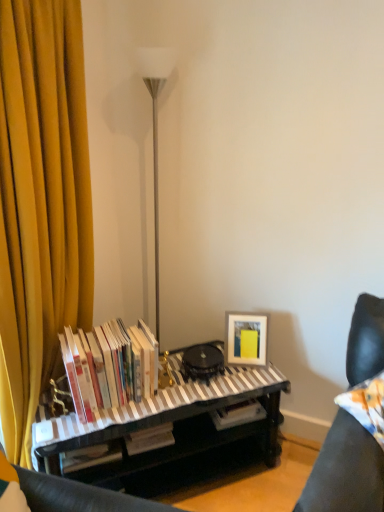
Question: Can you confirm if striped fabric piano at center is shorter than leather couch cushion at lower right?

Choices:
 (A) yes
 (B) no

Answer: (A)

Question: Is striped fabric piano at center at the right side of leather couch cushion at lower right?

Choices:
 (A) yes
 (B) no

Answer: (B)

Question: Could you tell me if striped fabric piano at center is facing leather couch cushion at lower right?

Choices:
 (A) yes
 (B) no

Answer: (B)

Question: From the image's perspective, is striped fabric piano at center beneath leather couch cushion at lower right?

Choices:
 (A) yes
 (B) no

Answer: (A)

Question: Is the surface of striped fabric piano at center in direct contact with leather couch cushion at lower right?

Choices:
 (A) no
 (B) yes

Answer: (A)

Question: Would you say leather couch cushion at lower right is inside or outside striped fabric piano at center?

Choices:
 (A) inside
 (B) outside

Answer: (B)

Question: Considering their positions, is leather couch cushion at lower right located in front of or behind striped fabric piano at center?

Choices:
 (A) behind
 (B) front

Answer: (B)

Question: In terms of height, does leather couch cushion at lower right look taller or shorter compared to striped fabric piano at center?

Choices:
 (A) short
 (B) tall

Answer: (B)

Question: Considering the positions of leather couch cushion at lower right and striped fabric piano at center in the image, is leather couch cushion at lower right wider or thinner than striped fabric piano at center?

Choices:
 (A) wide
 (B) thin

Answer: (B)

Question: Does point (236, 316) appear closer or farther from the camera than point (162, 454)?

Choices:
 (A) closer
 (B) farther

Answer: (B)

Question: Which is correct: matte white picture frame at lower right is inside striped fabric piano at center, or outside of it?

Choices:
 (A) inside
 (B) outside

Answer: (B)

Question: In terms of height, does matte white picture frame at lower right look taller or shorter compared to striped fabric piano at center?

Choices:
 (A) tall
 (B) short

Answer: (B)

Question: Looking at the image, does matte white picture frame at lower right seem bigger or smaller compared to striped fabric piano at center?

Choices:
 (A) small
 (B) big

Answer: (A)

Question: Considering the positions of striped fabric piano at center and matte white picture frame at lower right in the image, is striped fabric piano at center wider or thinner than matte white picture frame at lower right?

Choices:
 (A) thin
 (B) wide

Answer: (B)

Question: Considering the positions of striped fabric piano at center and matte white picture frame at lower right in the image, is striped fabric piano at center bigger or smaller than matte white picture frame at lower right?

Choices:
 (A) big
 (B) small

Answer: (A)